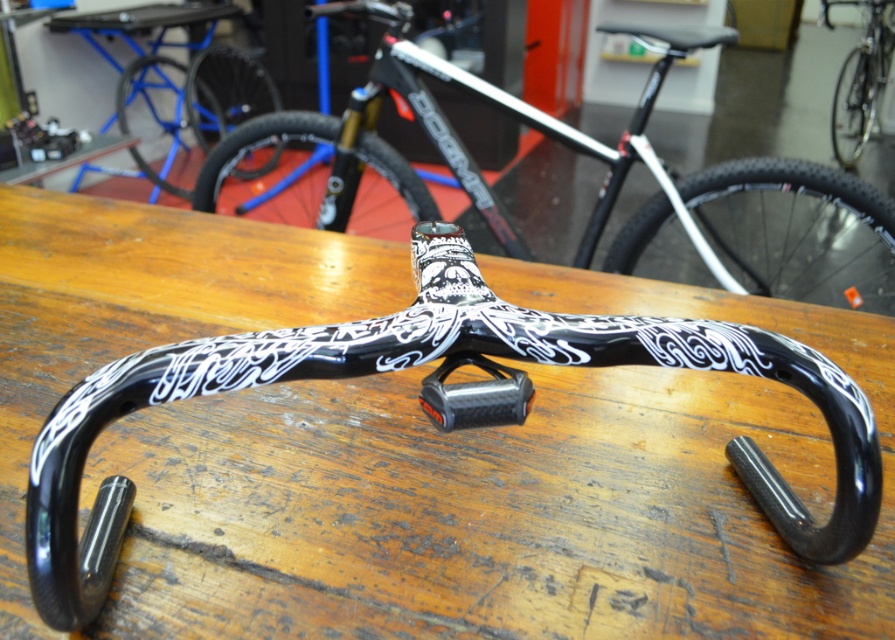
You are standing in front of the bicycle handlebar on the workbench. There are two points marked on the handlebar. One is at coordinate point (x=742, y=308) and the other at point (x=463, y=416). From your perspective, which point is closer to you?

Point (x=463, y=416) is closer to you because the description states that point (x=742, y=308) is behind point (x=463, y=416).

What is the relationship between the width of the black matte bicycle handlebar at center and the carbon fiber handlebar at center?

The black matte bicycle handlebar at center is wider than the carbon fiber handlebar at center.